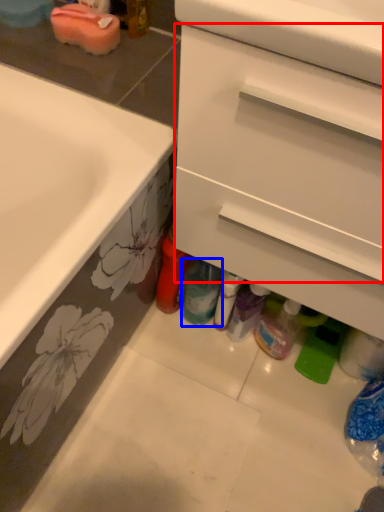
Question: Which object appears closest to the camera in this image, drawer (highlighted by a red box) or bottle (highlighted by a blue box)?

Choices:
 (A) drawer
 (B) bottle

Answer: (A)